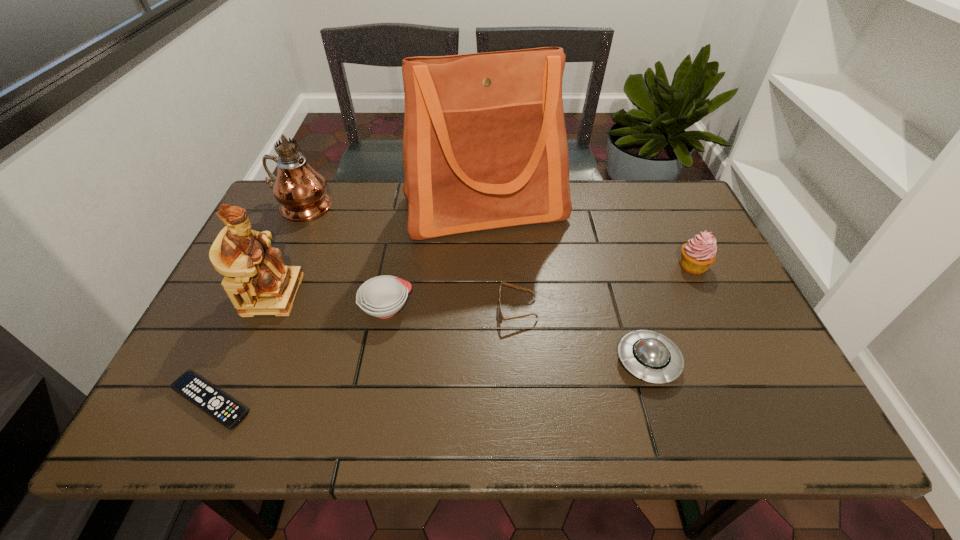
Identify which object is located as the fifth nearest to the oil lamp. Please provide its 2D coordinates. Your answer should be formatted as a tuple, i.e. [(x, y)], where the tuple contains the x and y coordinates of a point satisfying the conditions above.

[(500, 315)]

Find the location of a particular element. free space that satisfies the following two spatial constraints: 1. on the back side of the saucer; 2. on the front-facing side of the third tallest object is located at coordinates (627, 294).

Identify the location of free point that satisfies the following two spatial constraints: 1. on the front side of the shopping bag; 2. on the front-facing side of the figurine. The height and width of the screenshot is (540, 960). (486, 294).

Where is `blank area in the image that satisfies the following two spatial constraints: 1. on the front-facing side of the figurine; 2. on the left side of the second object from right to left`? blank area in the image that satisfies the following two spatial constraints: 1. on the front-facing side of the figurine; 2. on the left side of the second object from right to left is located at coordinates (244, 361).

You are a GUI agent. You are given a task and a screenshot of the screen. Output one action in this format:
    pyautogui.click(x=<x>, y=<y>)
    Task: Click on the free space in the image that satisfies the following two spatial constraints: 1. on the front side of the shopping bag; 2. on the front-facing side of the figurine
    
    Given the screenshot: What is the action you would take?
    pyautogui.click(x=486, y=294)

You are a GUI agent. You are given a task and a screenshot of the screen. Output one action in this format:
    pyautogui.click(x=<x>, y=<y>)
    Task: Click on the free location that satisfies the following two spatial constraints: 1. on the front-facing side of the soup bowl; 2. on the left side of the third tallest object
    
    Given the screenshot: What is the action you would take?
    pyautogui.click(x=267, y=308)

Find the location of a particular element. This screenshot has height=540, width=960. vacant space that satisfies the following two spatial constraints: 1. on the frames of the seventh tallest object; 2. on the right side of the saucer is located at coordinates (521, 361).